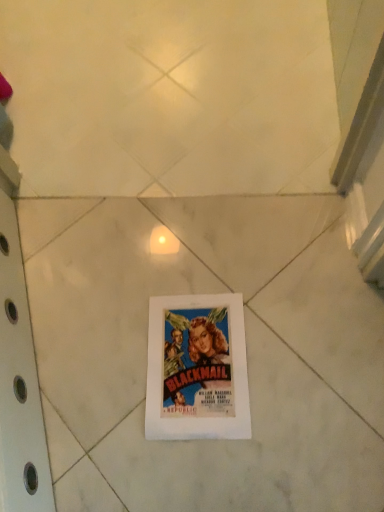
Question: Is white paper at center surrounded by white paper at center?

Choices:
 (A) yes
 (B) no

Answer: (A)

Question: From the image's perspective, would you say white paper at center is positioned over white paper at center?

Choices:
 (A) no
 (B) yes

Answer: (B)

Question: From a real-world perspective, does white paper at center sit lower than white paper at center?

Choices:
 (A) yes
 (B) no

Answer: (A)

Question: Does white paper at center have a larger size compared to white paper at center?

Choices:
 (A) yes
 (B) no

Answer: (A)

Question: Can you confirm if white paper at center is thinner than white paper at center?

Choices:
 (A) no
 (B) yes

Answer: (A)

Question: Is white paper at center shorter than white paper at center?

Choices:
 (A) yes
 (B) no

Answer: (B)

Question: From the image's perspective, would you say white paper at center is shown under white paper at center?

Choices:
 (A) no
 (B) yes

Answer: (B)

Question: Is white paper at center to the right of white paper at center from the viewer's perspective?

Choices:
 (A) no
 (B) yes

Answer: (B)

Question: Would you say white paper at center contains white paper at center?

Choices:
 (A) yes
 (B) no

Answer: (B)

Question: Is white paper at center taller than white paper at center?

Choices:
 (A) yes
 (B) no

Answer: (B)

Question: Is white paper at center smaller than white paper at center?

Choices:
 (A) yes
 (B) no

Answer: (A)

Question: Is white paper at center facing towards white paper at center?

Choices:
 (A) no
 (B) yes

Answer: (B)

Question: Is white paper at center wider or thinner than white paper at center?

Choices:
 (A) wide
 (B) thin

Answer: (A)